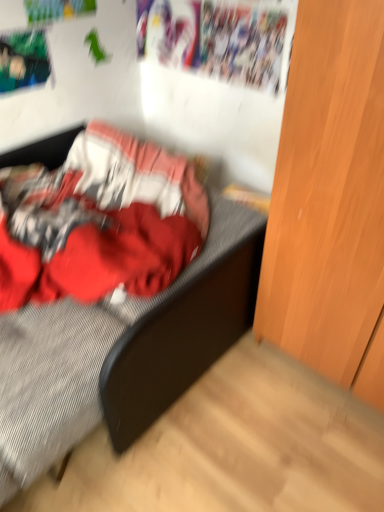
Find the location of `light brown wood dresser at right`. light brown wood dresser at right is located at coordinates (330, 199).

The height and width of the screenshot is (512, 384). What do you see at coordinates (330, 199) in the screenshot? I see `light brown wood dresser at right` at bounding box center [330, 199].

This screenshot has height=512, width=384. Describe the element at coordinates (118, 306) in the screenshot. I see `textured gray bed at center` at that location.

Find the location of a particular element. This screenshot has width=384, height=512. textured gray bed at center is located at coordinates (118, 306).

Locate an element on the screen. This screenshot has width=384, height=512. light brown wood dresser at right is located at coordinates (330, 199).

Considering the positions of objects textured gray bed at center and light brown wood dresser at right in the image provided, who is more to the left, textured gray bed at center or light brown wood dresser at right?

textured gray bed at center is more to the left.

Which object is closer to the camera, textured gray bed at center or light brown wood dresser at right?

light brown wood dresser at right is in front.

Is point (185, 244) more distant than point (362, 360)?

Yes.

From the image's perspective, relative to light brown wood dresser at right, is textured gray bed at center above or below?

From the image's perspective, textured gray bed at center appears below light brown wood dresser at right.

From a real-world perspective, relative to light brown wood dresser at right, is textured gray bed at center vertically above or below?

From a real-world perspective, textured gray bed at center is physically below light brown wood dresser at right.

Which object is thinner, textured gray bed at center or light brown wood dresser at right?

light brown wood dresser at right.

Considering the sizes of objects textured gray bed at center and light brown wood dresser at right in the image provided, who is shorter, textured gray bed at center or light brown wood dresser at right?

With less height is textured gray bed at center.

Considering the sizes of objects textured gray bed at center and light brown wood dresser at right in the image provided, who is smaller, textured gray bed at center or light brown wood dresser at right?

light brown wood dresser at right is smaller.

Is textured gray bed at center situated inside light brown wood dresser at right or outside?

textured gray bed at center lies outside light brown wood dresser at right.

Would you say textured gray bed at center is a long distance from light brown wood dresser at right?

Actually, textured gray bed at center and light brown wood dresser at right are a little close together.

Could you tell me if textured gray bed at center is turned towards light brown wood dresser at right?

No, textured gray bed at center is not facing towards light brown wood dresser at right.

What's the angular difference between textured gray bed at center and light brown wood dresser at right's facing directions?

The angle between the facing direction of textured gray bed at center and the facing direction of light brown wood dresser at right is 179 degrees.

The height and width of the screenshot is (512, 384). I want to click on bed below the light brown wood dresser at right (from the image's perspective), so click(118, 306).

Is light brown wood dresser at right at the left side of textured gray bed at center?

No, light brown wood dresser at right is not to the left of textured gray bed at center.

Is light brown wood dresser at right further to camera compared to textured gray bed at center?

That is False.

Does point (336, 168) come closer to viewer compared to point (92, 156)?

Yes.

From the picture: From the image's perspective, which one is positioned higher, light brown wood dresser at right or textured gray bed at center?

light brown wood dresser at right.

From a real-world perspective, is light brown wood dresser at right below textured gray bed at center?

Incorrect, from a real-world perspective, light brown wood dresser at right is higher than textured gray bed at center.

In the scene shown: Between light brown wood dresser at right and textured gray bed at center, which one has smaller width?

With smaller width is light brown wood dresser at right.

Considering the relative sizes of light brown wood dresser at right and textured gray bed at center in the image provided, is light brown wood dresser at right shorter than textured gray bed at center?

Incorrect, the height of light brown wood dresser at right does not fall short of that of textured gray bed at center.

In terms of size, does light brown wood dresser at right appear bigger or smaller than textured gray bed at center?

In the image, light brown wood dresser at right appears to be smaller than textured gray bed at center.

Choose the correct answer: Is light brown wood dresser at right inside textured gray bed at center or outside it?

light brown wood dresser at right is not inside textured gray bed at center, it's outside.

Is light brown wood dresser at right not close to textured gray bed at center?

Actually, light brown wood dresser at right and textured gray bed at center are a little close together.

Could you tell me if light brown wood dresser at right is turned towards textured gray bed at center?

No, light brown wood dresser at right is not facing towards textured gray bed at center.

How different are the orientations of light brown wood dresser at right and textured gray bed at center in degrees?

The angle between the facing direction of light brown wood dresser at right and the facing direction of textured gray bed at center is 179 degrees.

In order to click on dresser that appears in front of the textured gray bed at center in this screenshot , I will do pyautogui.click(x=330, y=199).

Locate an element on the screen. The width and height of the screenshot is (384, 512). bed below the light brown wood dresser at right (from the image's perspective) is located at coordinates point(118,306).

You are a GUI agent. You are given a task and a screenshot of the screen. Output one action in this format:
    pyautogui.click(x=<x>, y=<y>)
    Task: Click on the bed that appears behind the light brown wood dresser at right
    
    Given the screenshot: What is the action you would take?
    pyautogui.click(x=118, y=306)